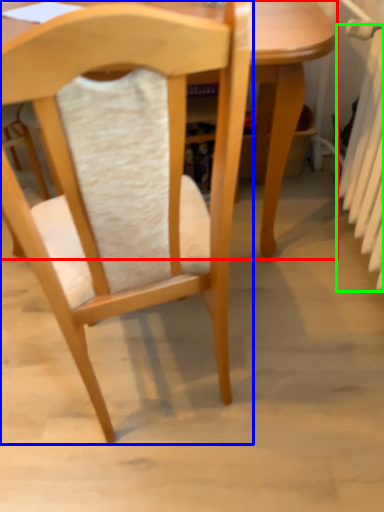
Question: Based on their relative distances, which object is farther from table (highlighted by a red box)? Choose from chair (highlighted by a blue box) and radiator (highlighted by a green box).

Choices:
 (A) chair
 (B) radiator

Answer: (A)